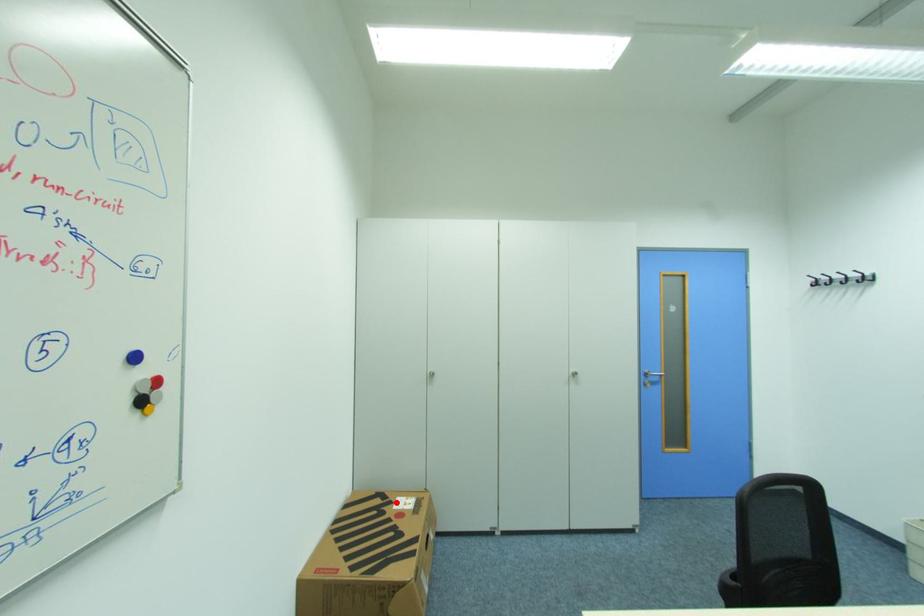
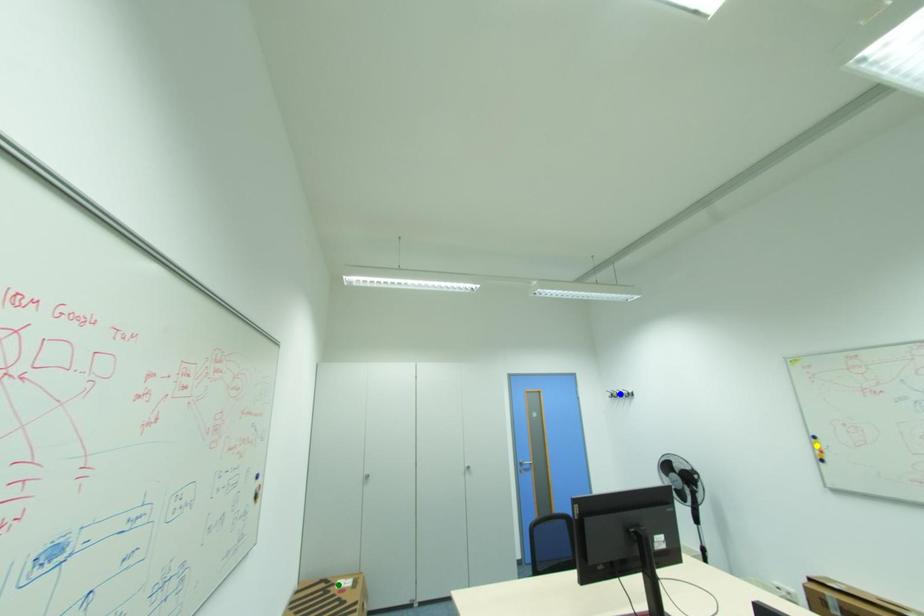
Question: I am providing you with two images of the same scene from different viewpoints. A red point is marked on the first image. You are given multiple points on the second image. In image 2, which mark is for the same physical point as the one in image 1?

Choices:
 (A) blue point
 (B) yellow point
 (C) green point

Answer: (C)